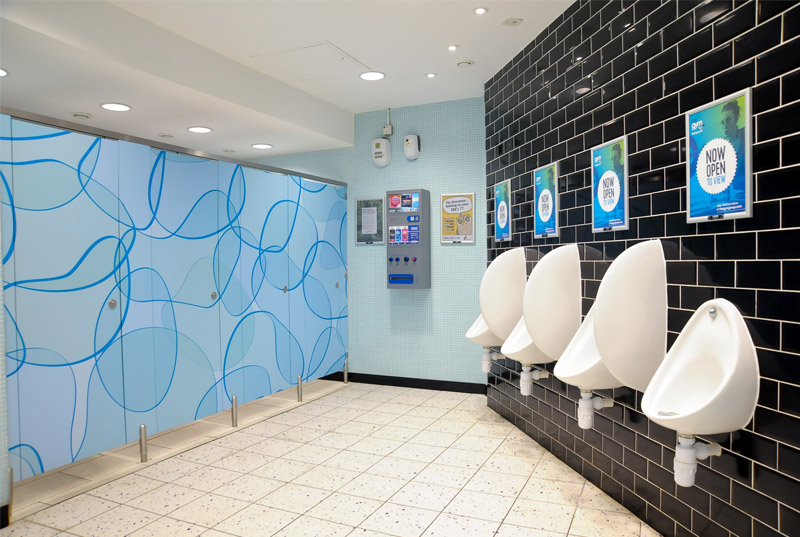
This screenshot has height=537, width=800. Identify the location of ceiling light. (117, 110), (2, 71), (198, 129), (262, 147), (381, 76), (428, 77), (453, 43), (482, 11).